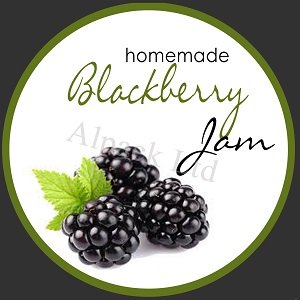
Locate an element on the screen. This screenshot has height=300, width=300. frame is located at coordinates (84, 19).